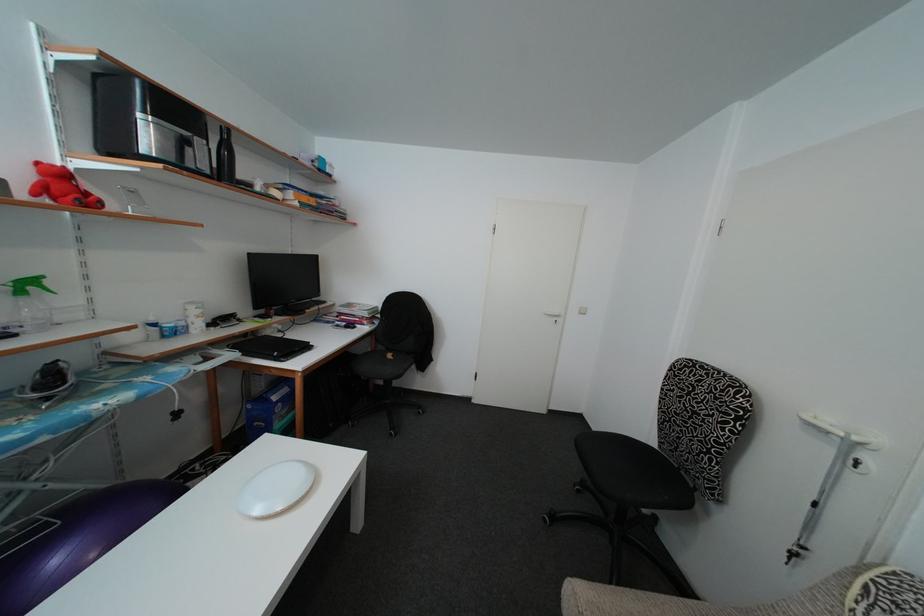
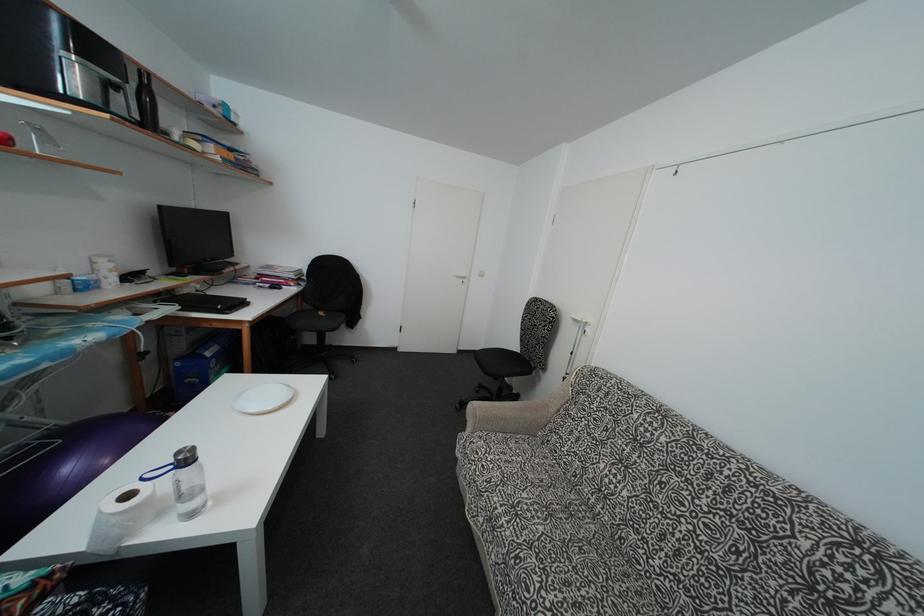
Locate, in the second image, the point that corresponds to the point at 393,362 in the first image.

(325, 320)